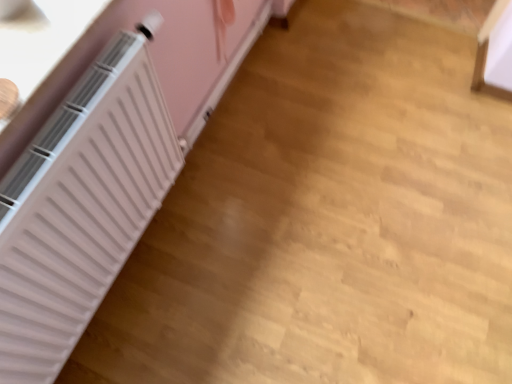
Locate an element on the screen. Image resolution: width=512 pixels, height=384 pixels. free space underneath white matte radiator at left (from a real-world perspective) is located at coordinates (186, 172).